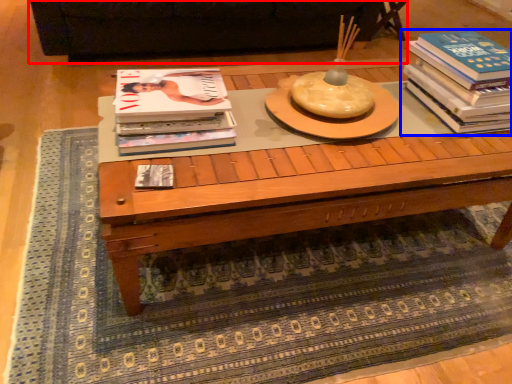
Question: Which point is further to the camera, couch (highlighted by a red box) or book (highlighted by a blue box)?

Choices:
 (A) couch
 (B) book

Answer: (A)